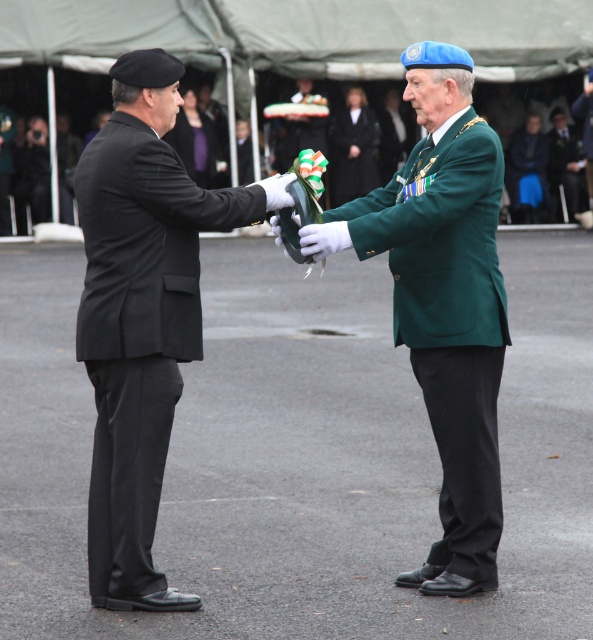
The height and width of the screenshot is (640, 593). Find the location of `blue fabric pants at lower right`. blue fabric pants at lower right is located at coordinates (527, 170).

Does blue fabric pants at lower right have a lesser width compared to green fabric uniform at center?

Incorrect, blue fabric pants at lower right's width is not less than green fabric uniform at center's.

Based on the photo, measure the distance between blue fabric pants at lower right and camera.

92.84 feet

Where is `blue fabric pants at lower right`? The image size is (593, 640). blue fabric pants at lower right is located at coordinates (527, 170).

Between point (514, 188) and point (279, 148), which one is positioned in front?

Point (279, 148) is in front.

This screenshot has height=640, width=593. What are the coordinates of `blue fabric pants at lower right` in the screenshot? It's located at (527, 170).

Where is `blue fabric pants at lower right`? blue fabric pants at lower right is located at coordinates (527, 170).

Is black wool beret at upper center smaller than green fabric flag at upper center?

Incorrect, black wool beret at upper center is not smaller in size than green fabric flag at upper center.

Between black wool beret at upper center and green fabric flag at upper center, which one appears on the left side from the viewer's perspective?

green fabric flag at upper center is more to the left.

The width and height of the screenshot is (593, 640). Find the location of `black wool beret at upper center`. black wool beret at upper center is located at coordinates (352, 148).